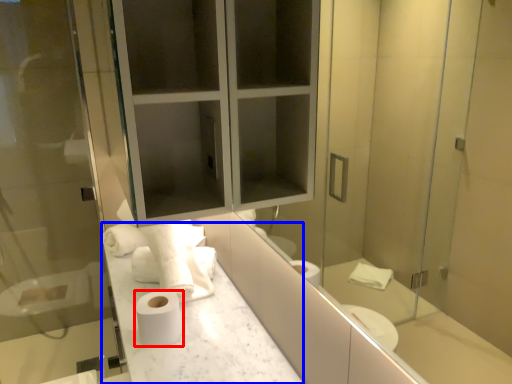
Question: Which point is closer to the camera, toilet paper (highlighted by a red box) or counter top (highlighted by a blue box)?

Choices:
 (A) toilet paper
 (B) counter top

Answer: (B)